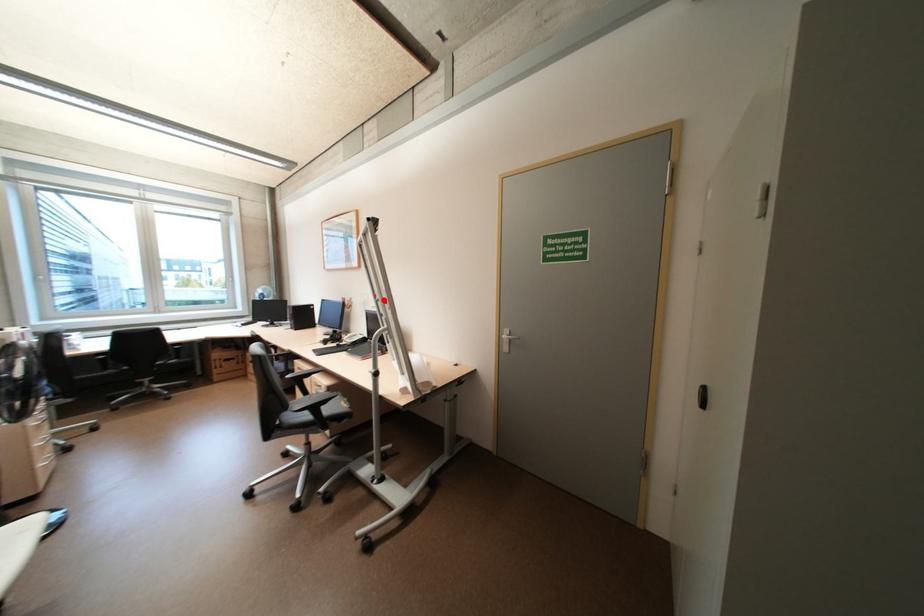
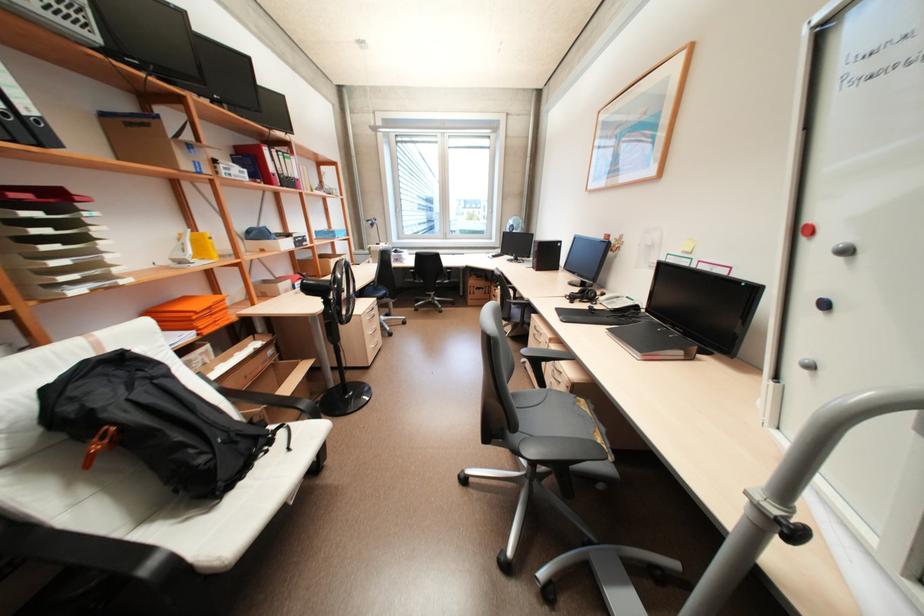
Where in the second image is the point corresponding to the highlighted location from the first image?

(852, 252)